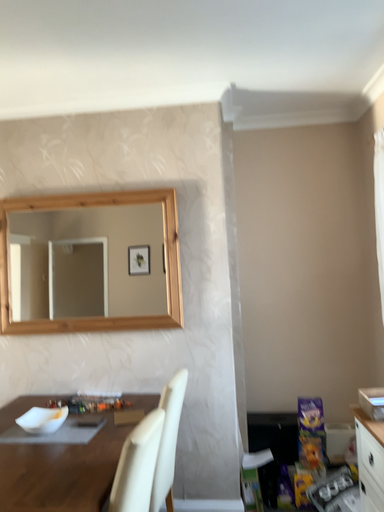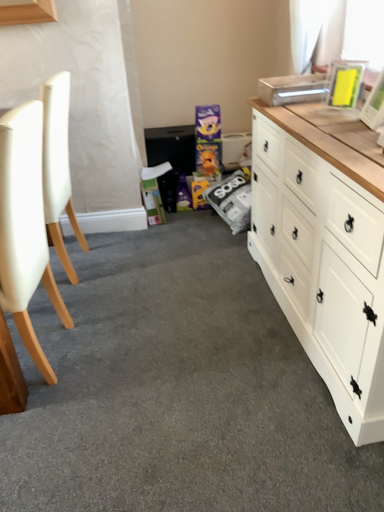
Question: Which way did the camera rotate in the video?

Choices:
 (A) rotated right
 (B) rotated left

Answer: (A)